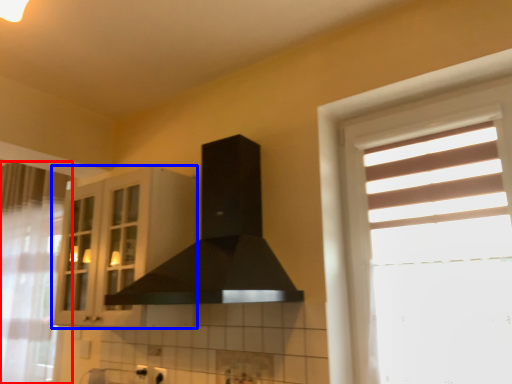
Question: Which object is closer to the camera taking this photo, curtain (highlighted by a red box) or cabinetry (highlighted by a blue box)?

Choices:
 (A) curtain
 (B) cabinetry

Answer: (B)